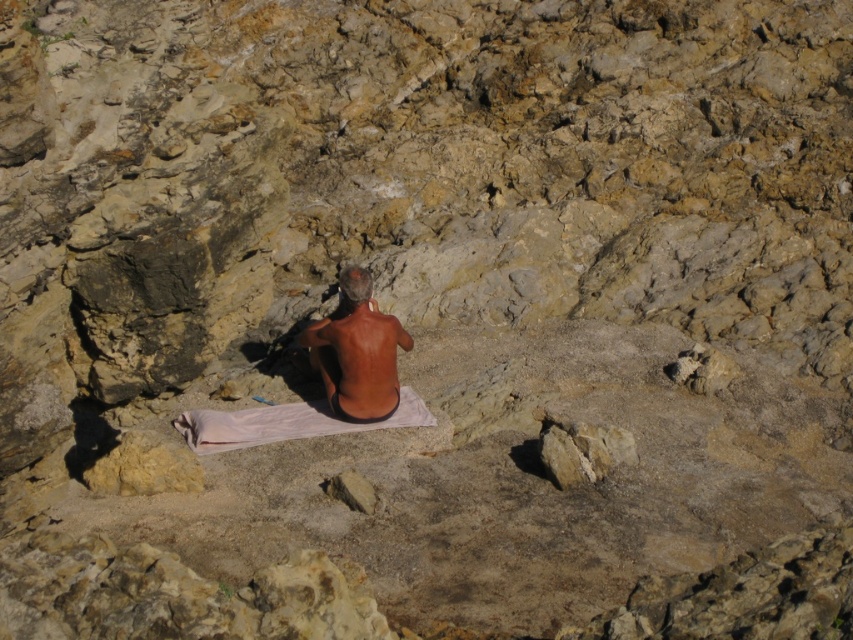
Is brown matte skin at center thinner than white cloth at center?

Yes, brown matte skin at center is thinner than white cloth at center.

Does brown matte skin at center have a greater width compared to white cloth at center?

No, brown matte skin at center is not wider than white cloth at center.

Is point (390, 365) positioned after point (229, 420)?

Yes, point (390, 365) is farther from viewer.

I want to click on brown matte skin at center, so click(x=357, y=352).